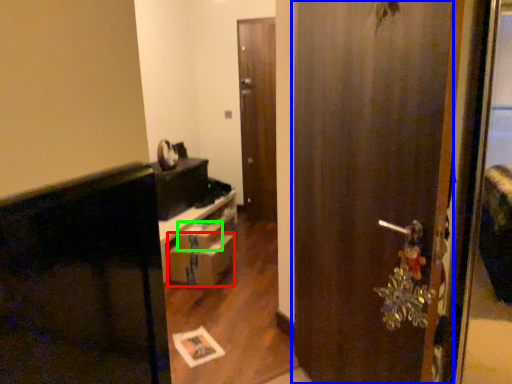
Question: Considering the real-world distances, which object is closest to drawer (highlighted by a red box)? door (highlighted by a blue box) or box (highlighted by a green box).

Choices:
 (A) door
 (B) box

Answer: (B)